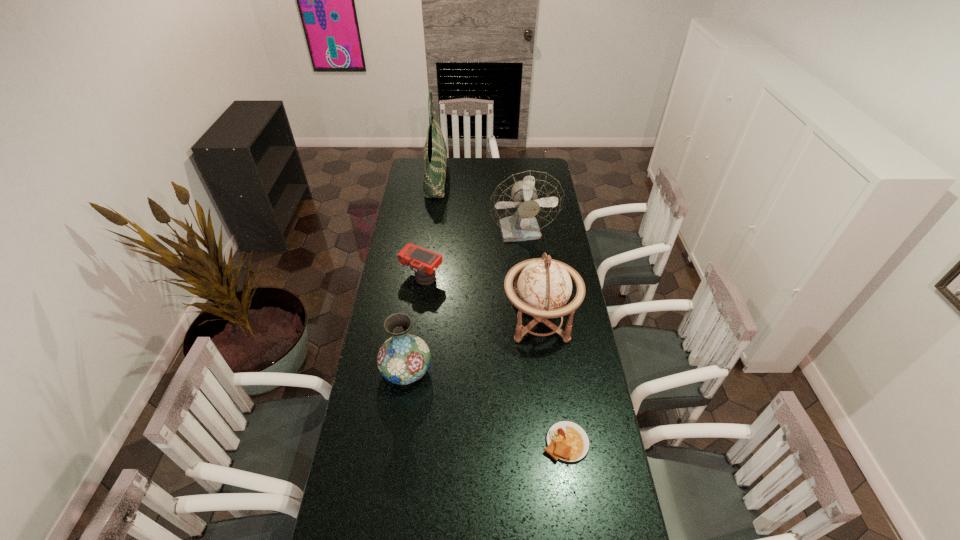
At what (x,y) coordinates should I click in order to perform the action: click on blank region between the globe and the camera. Please return your answer as a coordinate pair (x, y). Image resolution: width=960 pixels, height=540 pixels. Looking at the image, I should click on (481, 299).

Find the location of a particular element. This screenshot has height=540, width=960. unoccupied position between the fifth nearest object and the tote bag is located at coordinates (479, 206).

The image size is (960, 540). I want to click on free space between the fan and the tote bag, so click(x=479, y=206).

Identify the location of vacant area that lies between the fan and the omelet. This screenshot has height=540, width=960. (544, 338).

I want to click on free point between the third shortest object and the third farthest object, so click(x=415, y=323).

Identify the location of free space between the fan and the second shortest object. Image resolution: width=960 pixels, height=540 pixels. (472, 255).

The image size is (960, 540). I want to click on free space between the second farthest object and the third shortest object, so click(x=465, y=302).

Locate an element on the screen. free space between the fifth tallest object and the tallest object is located at coordinates (429, 228).

Where is `empty space between the globe and the third shortest object`? The image size is (960, 540). empty space between the globe and the third shortest object is located at coordinates (473, 346).

Locate an element on the screen. object that stands as the second closest to the omelet is located at coordinates (404, 358).